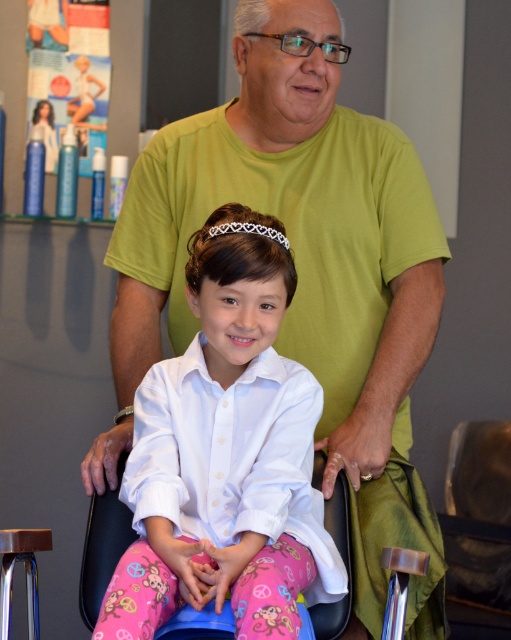
Find the location of a particular element. pink fabric wheelchair at center is located at coordinates (102, 548).

You are a GUI agent. You are given a task and a screenshot of the screen. Output one action in this format:
    pyautogui.click(x=<x>, y=<y>)
    Task: Click on the pink fabric wheelchair at center
    The image size is (511, 640).
    Given the screenshot: What is the action you would take?
    pyautogui.click(x=102, y=548)

How much distance is there between green cotton shirt at center and white lace tiara at center?

18.87 inches

What do you see at coordinates (301, 275) in the screenshot? I see `green cotton shirt at center` at bounding box center [301, 275].

At what (x,y) coordinates should I click in order to perform the action: click on green cotton shirt at center. Please return your answer as a coordinate pair (x, y). This screenshot has width=511, height=640. Looking at the image, I should click on (301, 275).

Which is more to the right, white satin shirt at center or white lace tiara at center?

Positioned to the right is white lace tiara at center.

Is white satin shirt at center thinner than white lace tiara at center?

In fact, white satin shirt at center might be wider than white lace tiara at center.

The image size is (511, 640). What do you see at coordinates (225, 456) in the screenshot?
I see `white satin shirt at center` at bounding box center [225, 456].

The height and width of the screenshot is (640, 511). Identify the location of white satin shirt at center. coord(225,456).